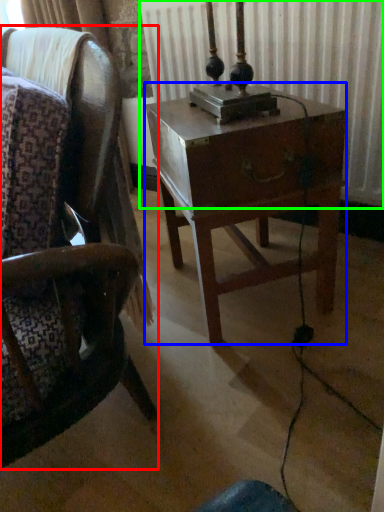
Question: Which object is positioned farthest from chair (highlighted by a red box)? Select from nightstand (highlighted by a blue box) and radiator (highlighted by a green box).

Choices:
 (A) nightstand
 (B) radiator

Answer: (B)